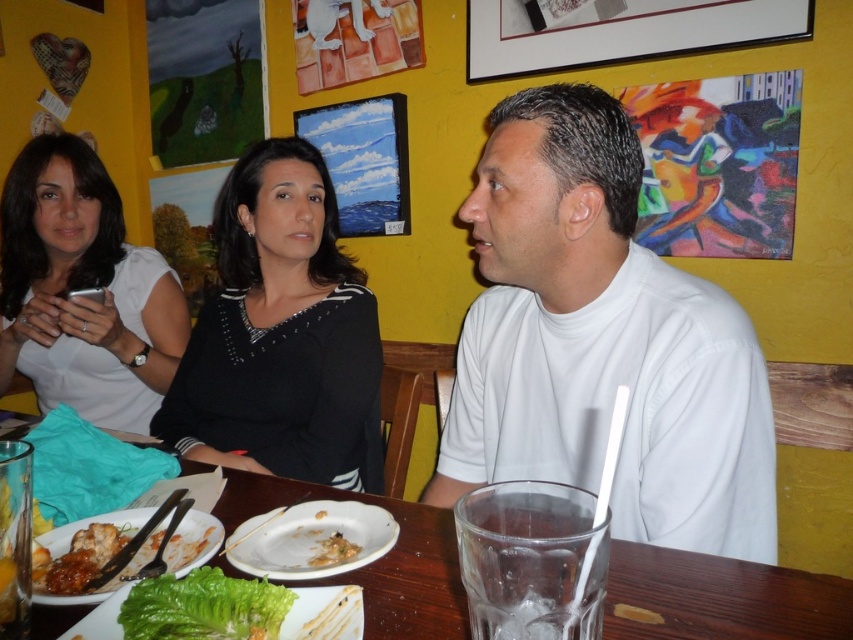
Is point (355, 564) positioned before point (186, 572)?

No, (355, 564) is behind (186, 572).

Which is in front, point (311, 544) or point (132, 563)?

Point (132, 563) is in front.

Where is `white matte plate at lower center`? white matte plate at lower center is located at coordinates (311, 540).

The image size is (853, 640). What are the coordinates of `white matte plate at lower center` in the screenshot? It's located at (311, 540).

From the picture: Is black jersey at center further to the viewer compared to white glossy plate at lower left?

That is True.

Who is taller, black jersey at center or white glossy plate at lower left?

With more height is black jersey at center.

What do you see at coordinates (280, 333) in the screenshot? This screenshot has height=640, width=853. I see `black jersey at center` at bounding box center [280, 333].

Locate an element on the screen. black jersey at center is located at coordinates (280, 333).

Can you confirm if transparent glass at center is positioned below green leafy lettuce at lower left?

Yes, transparent glass at center is below green leafy lettuce at lower left.

Between transparent glass at center and green leafy lettuce at lower left, which one has less height?

With less height is green leafy lettuce at lower left.

Between point (462, 625) and point (229, 625), which one is positioned behind?

The point (462, 625) is behind.

You are a GUI agent. You are given a task and a screenshot of the screen. Output one action in this format:
    pyautogui.click(x=<x>, y=<y>)
    Task: Click on the transparent glass at center
    This screenshot has height=640, width=853.
    Given the screenshot: What is the action you would take?
    722,596